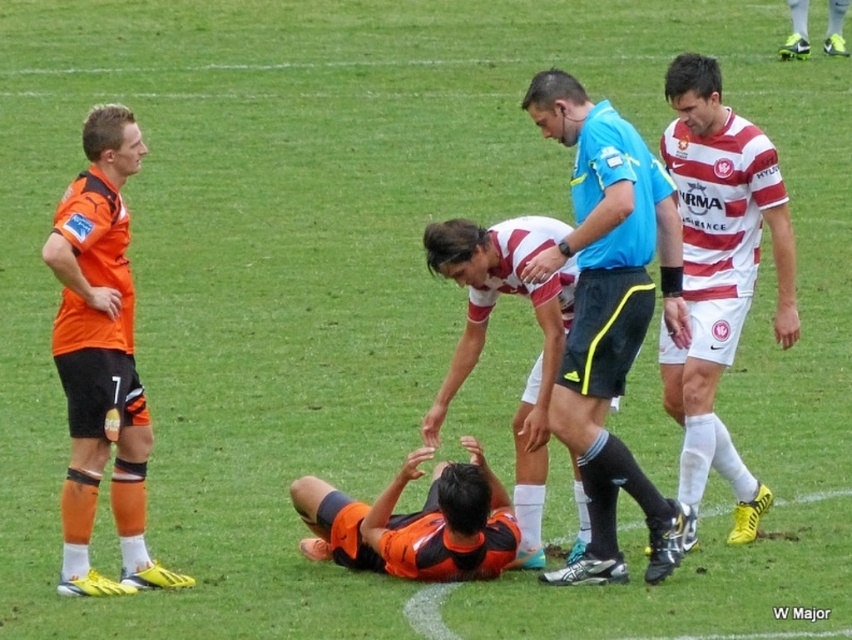
Is point (691, 81) positioned behind point (491, 266)?

Yes, it is.

You are a GUI agent. You are given a task and a screenshot of the screen. Output one action in this format:
    pyautogui.click(x=<x>, y=<y>)
    Task: Click on the striped jersey at right
    This screenshot has width=852, height=640.
    Given the screenshot: What is the action you would take?
    pyautogui.click(x=718, y=269)

Locate an element on the screen. This screenshot has width=852, height=640. striped jersey at right is located at coordinates (718, 269).

Looking at this image, is blue short-sleeved shirt at center smaller than orange matte shorts at left?

Actually, blue short-sleeved shirt at center might be larger than orange matte shorts at left.

Can you confirm if blue short-sleeved shirt at center is positioned to the left of orange matte shorts at left?

Incorrect, blue short-sleeved shirt at center is not on the left side of orange matte shorts at left.

Find the location of a particular element. The image size is (852, 640). blue short-sleeved shirt at center is located at coordinates (608, 314).

Find the location of a particular element. Image resolution: width=852 pixels, height=640 pixels. blue short-sleeved shirt at center is located at coordinates (608, 314).

Between orange matte shorts at left and orange jersey at center, which one appears on the left side from the viewer's perspective?

From the viewer's perspective, orange matte shorts at left appears more on the left side.

Can you confirm if orange matte shorts at left is wider than orange jersey at center?

No.

Is point (130, 433) in front of point (324, 538)?

Yes.

Locate an element on the screen. Image resolution: width=852 pixels, height=640 pixels. orange matte shorts at left is located at coordinates pyautogui.click(x=101, y=358).